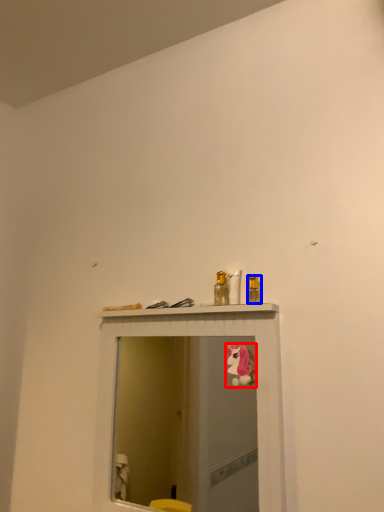
Question: Which point is closer to the camera, animal (highlighted by a red box) or toiletry (highlighted by a blue box)?

Choices:
 (A) animal
 (B) toiletry

Answer: (A)